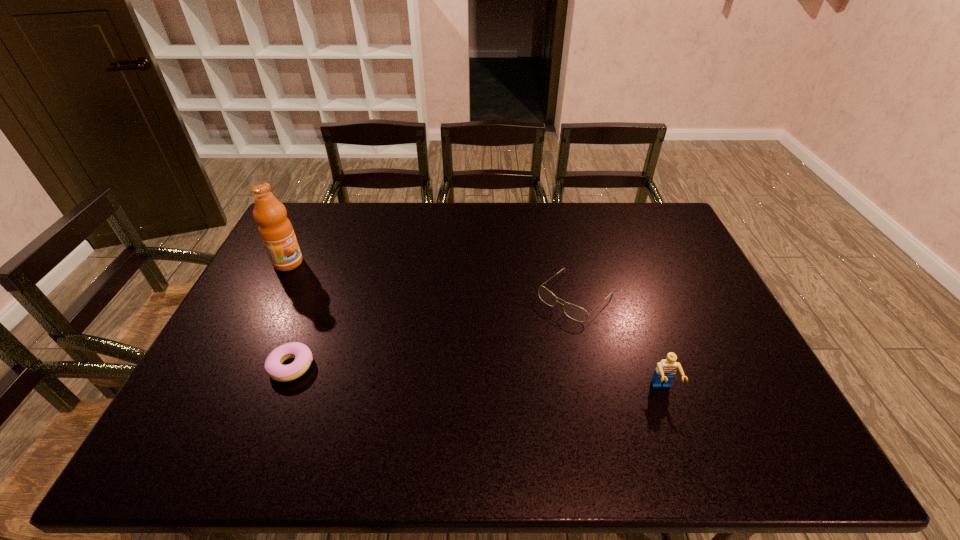
The image size is (960, 540). I want to click on free space on the desktop that is between the second object from left to right and the Lego and is positioned on the front-facing side of the spectacles, so click(490, 379).

At what (x,y) coordinates should I click in order to perform the action: click on free space on the desktop that is between the shortest object and the second tallest object and is positioned on the label side of the leftmost object. Please return your answer as a coordinate pair (x, y). Looking at the image, I should click on (492, 379).